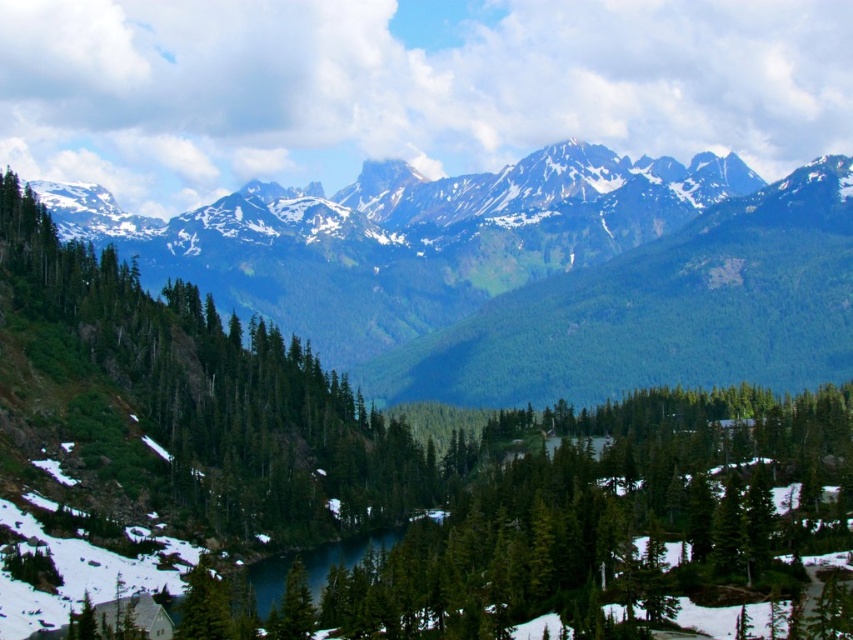
You are a hiker standing at the edge of the lake in the scene. You notice the green matte tree at center and the green textured mountains at center. Which object is closer to you?

The green textured mountains at center are closer to you because the green matte tree at center is behind them.

You are an environmental scientist assessing the landscape. You need to determine which object occupies more horizontal space in the image between the green textured mountains at center and the green matte tree at center. Based on the scene description, which one is wider?

The green textured mountains at center are wider than the green matte tree at center because their width surpasses that of the tree.

You are standing at the edge of the lake and want to take a photo of both the green textured mountains at center and the green matte tree at center. Which object should you position to your left to include both in the frame?

You should position the green matte tree at center to your left because the green textured mountains at center is to the right of it, ensuring both are in the frame.